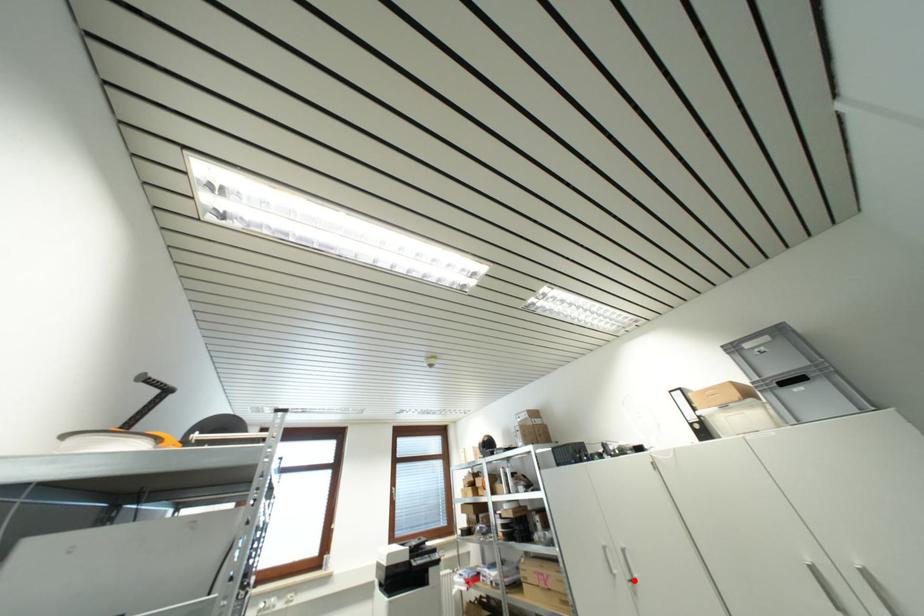
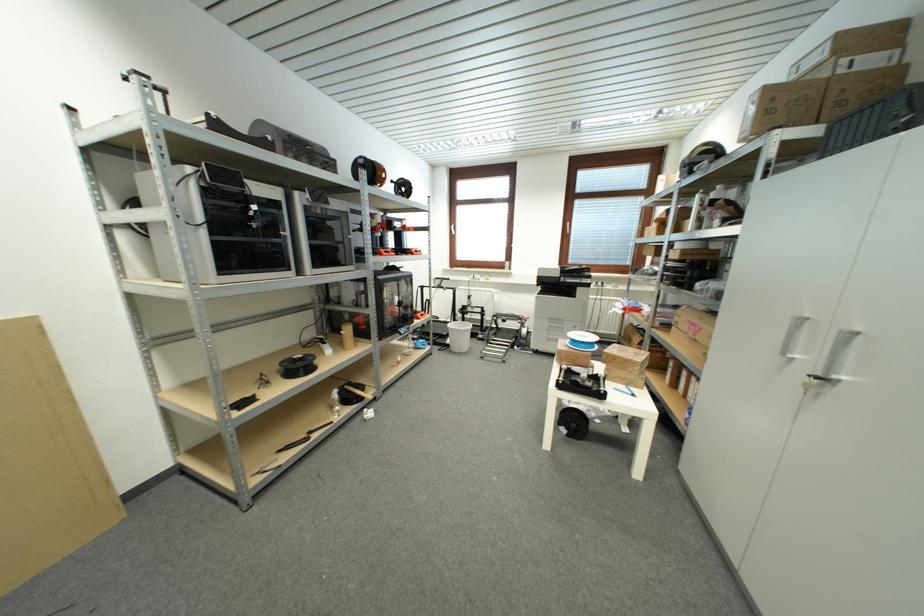
The point at the highlighted location is marked in the first image. Where is the corresponding point in the second image?

(822, 376)